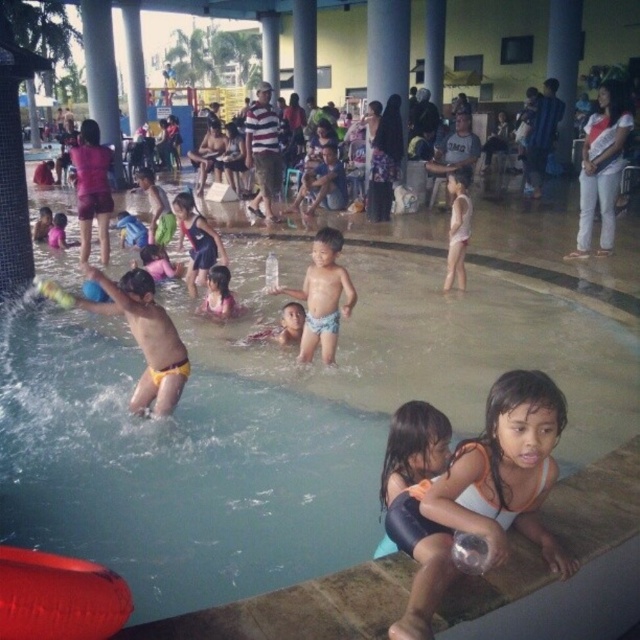
Question: Among these points, which one is nearest to the camera?

Choices:
 (A) (454, 275)
 (B) (540, 461)
 (C) (618, 100)

Answer: (B)

Question: Is matte pink shirt at upper left thinner than pink fabric dress at center?

Choices:
 (A) yes
 (B) no

Answer: (B)

Question: Does yellow swim trunks at left appear on the right side of matte pink swimsuit at center?

Choices:
 (A) no
 (B) yes

Answer: (A)

Question: Which of the following is the closest to the observer?

Choices:
 (A) (589, 228)
 (B) (220, 298)

Answer: (B)

Question: In this image, where is white matte swimsuit at lower right located relative to light blue swim trunks at center?

Choices:
 (A) below
 (B) above

Answer: (A)

Question: Which of the following is the closest to the observer?

Choices:
 (A) (472, 515)
 (B) (593, 116)
 (C) (445, 257)

Answer: (A)